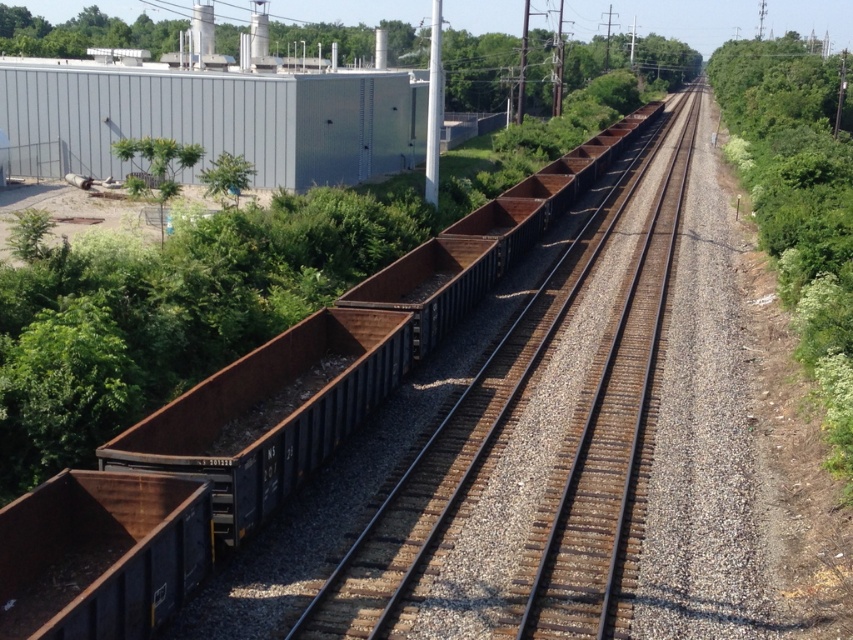
You are standing at the point with coordinates (606, 445). Which object are you standing on?

You are standing on the rusty metal train track at center.

You are standing on the right track and looking towards the left track. Which green leafy tree is closer to the left track, the green leafy tree at upper center or the green leafy tree at upper left?

The green leafy tree at upper center is closer to the left track because it is positioned to the left of the green leafy tree at upper left, meaning it is nearer to the left track.